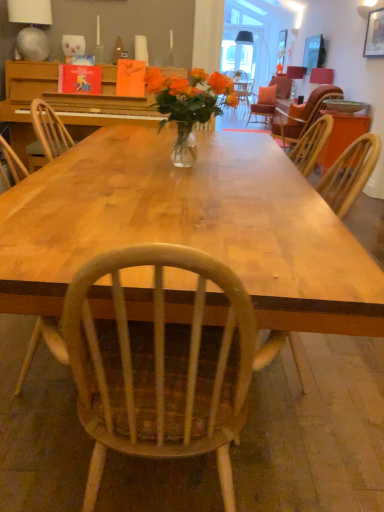
Identify the location of matte pink lampshade at upper right, which is the second lamp in top-to-bottom order. (320, 78).

What do you see at coordinates (296, 72) in the screenshot?
I see `matte black lampshade at upper center, placed as the 1th lamp when sorted from top to bottom` at bounding box center [296, 72].

Where is `matte white bowl at upper right`? Image resolution: width=384 pixels, height=512 pixels. matte white bowl at upper right is located at coordinates coord(345,106).

What is the approximate height of wooden chair at right?

wooden chair at right is 37.35 inches in height.

You are a GUI agent. You are given a task and a screenshot of the screen. Output one action in this format:
    pyautogui.click(x=<x>, y=<y>)
    Task: Click on the matte pink lampshade at upper right, which is the second lamp in top-to-bottom order
    
    Given the screenshot: What is the action you would take?
    pyautogui.click(x=320, y=78)

From a real-world perspective, which object rests below the other?

wooden table at right, from a real-world perspective.

Does matte white bowl at upper right have a smaller size compared to wooden table at right?

Yes, matte white bowl at upper right is smaller than wooden table at right.

Is matte white bowl at upper right far from wooden table at right?

No, there isn't a large distance between matte white bowl at upper right and wooden table at right.

Which is more to the left, matte white bowl at upper right or wooden table at right?

From the viewer's perspective, wooden table at right appears more on the left side.

From the image's perspective, would you say wooden chair at right is positioned over shiny wood table at center?

Yes, from the image's perspective, wooden chair at right is on top of shiny wood table at center.

Does wooden chair at right lie behind shiny wood table at center?

Yes, it is behind shiny wood table at center.

Can you confirm if wooden chair at right is positioned to the left of shiny wood table at center?

No.

Is shiny wood table at center completely or partially inside wooden chair at right?

Definitely not — shiny wood table at center is not inside wooden chair at right.

From the picture: Is natural wood table at center far away from metallic silver lampshade at upper left, which is the first lamp from bottom to top?

That's right, there is a large distance between natural wood table at center and metallic silver lampshade at upper left, which is the first lamp from bottom to top.

Consider the image. Measure the distance from natural wood table at center to metallic silver lampshade at upper left, which is the first lamp from bottom to top.

natural wood table at center is 1.04 meters from metallic silver lampshade at upper left, which is the first lamp from bottom to top.

Between natural wood table at center and metallic silver lampshade at upper left, which is the first lamp from bottom to top, which one has larger size?

natural wood table at center.

Is natural wood table at center spatially inside metallic silver lampshade at upper left, which is the first lamp from bottom to top, or outside of it?

natural wood table at center lies outside metallic silver lampshade at upper left, which is the first lamp from bottom to top.

Which object is positioned more to the right, orange paper card at center, which appears as the 2th book when viewed from the left, or matte pink lampshade at upper right, which is the second lamp in top-to-bottom order?

Positioned to the right is matte pink lampshade at upper right, which is the second lamp in top-to-bottom order.

This screenshot has width=384, height=512. What are the coordinates of `lamp that is the 2nd object located above the orange paper card at center, which appears as the 2th book when viewed from the left (from the image's perspective)` in the screenshot? It's located at (320, 78).

Is orange paper card at center, which appears as the 2th book when viewed from the left, outside of matte pink lampshade at upper right, which is the second lamp in bottom-to-top order?

Yes, orange paper card at center, which appears as the 2th book when viewed from the left, is located beyond the bounds of matte pink lampshade at upper right, which is the second lamp in bottom-to-top order.

From the image's perspective, which object appears higher, orange paper card at center, which ranks as the 1th book in right-to-left order, or matte pink lampshade at upper right, which is the second lamp in top-to-bottom order?

matte pink lampshade at upper right, which is the second lamp in top-to-bottom order.

Is translucent glass vase at center located outside matte wooden frame at upper right?

Absolutely, translucent glass vase at center is external to matte wooden frame at upper right.

Which of these two, translucent glass vase at center or matte wooden frame at upper right, is bigger?

Bigger between the two is translucent glass vase at center.

Which point is more distant from viewer, (215, 93) or (378, 12)?

The point (378, 12) is more distant.

From their relative heights in the image, would you say translucent glass vase at center is taller or shorter than matte wooden frame at upper right?

Clearly, translucent glass vase at center is shorter compared to matte wooden frame at upper right.

In terms of size, does translucent glass vase at center appear bigger or smaller than matte black lampshade at upper center, placed as the third lamp when sorted from bottom to top?

In the image, translucent glass vase at center appears to be larger than matte black lampshade at upper center, placed as the third lamp when sorted from bottom to top.

From a real-world perspective, is translucent glass vase at center positioned above or below matte black lampshade at upper center, placed as the 1th lamp when sorted from back to front?

In terms of real-world spatial position, translucent glass vase at center is above matte black lampshade at upper center, placed as the 1th lamp when sorted from back to front.

Can you tell me how much translucent glass vase at center and matte black lampshade at upper center, placed as the 1th lamp when sorted from top to bottom, differ in facing direction?

89.6 degrees.

Image resolution: width=384 pixels, height=512 pixels. I want to click on flower in front of the matte black lampshade at upper center, placed as the third lamp when sorted from bottom to top, so pyautogui.click(x=190, y=95).

In terms of size, does wooden table at right appear bigger or smaller than translucent glass vase at center?

Considering their sizes, wooden table at right takes up more space than translucent glass vase at center.

From the image's perspective, is wooden table at right on translucent glass vase at center?

Yes, from the image's perspective, wooden table at right is above translucent glass vase at center.

Is wooden table at right positioned far away from translucent glass vase at center?

No, wooden table at right is not far from translucent glass vase at center.

Could you tell me if wooden table at right is facing translucent glass vase at center?

No, wooden table at right is not oriented towards translucent glass vase at center.

Locate an element on the screen. table behind the matte white bowl at upper right is located at coordinates (341, 135).

I want to click on desk that is under the wooden chair at right (from a real-world perspective), so click(190, 227).

Looking at the image, which one is located closer to orange paper card at center, which ranks as the 1th book in right-to-left order, matte black lampshade at upper center, placed as the third lamp when sorted from bottom to top, or shiny wood table at center?

Among the two, matte black lampshade at upper center, placed as the third lamp when sorted from bottom to top, is located nearer to orange paper card at center, which ranks as the 1th book in right-to-left order.

Looking at the image, which one is located further to shiny wood table at center, hardcover book at upper left, which ranks as the second book in right-to-left order, or matte black lampshade at upper center, which is the 3th lamp from front to back?

The object further to shiny wood table at center is matte black lampshade at upper center, which is the 3th lamp from front to back.

Based on their spatial positions, is hardcover book at upper left, which ranks as the second book in right-to-left order, or wooden table at right further from orange paper card at center, which ranks as the 1th book in right-to-left order?

wooden table at right is further to orange paper card at center, which ranks as the 1th book in right-to-left order.

Which object lies nearer to the anchor point orange paper card at center, which ranks as the 1th book in right-to-left order, matte pink lampshade at upper right, which is counted as the 2th lamp, starting from the right, or matte black lampshade at upper center, placed as the 1th lamp when sorted from top to bottom?

Based on the image, matte black lampshade at upper center, placed as the 1th lamp when sorted from top to bottom, appears to be nearer to orange paper card at center, which ranks as the 1th book in right-to-left order.

When comparing their distances from hardcover book at upper left, which ranks as the second book in right-to-left order, does natural wood table at center or wooden chair at right seem closer?

Among the two, natural wood table at center is located nearer to hardcover book at upper left, which ranks as the second book in right-to-left order.

When comparing their distances from matte black lampshade at upper center, placed as the third lamp when sorted from bottom to top, does shiny wood table at center or matte wooden frame at upper right seem further?

shiny wood table at center is further to matte black lampshade at upper center, placed as the third lamp when sorted from bottom to top.

Considering their positions, is wooden chair at right positioned closer to matte pink lampshade at upper right, which is counted as the 2th lamp, starting from the right, than matte wooden frame at upper right?

The object closer to matte pink lampshade at upper right, which is counted as the 2th lamp, starting from the right, is matte wooden frame at upper right.

Looking at this image, estimate the real-world distances between objects in this image. Which object is closer to wooden chair at right, translucent glass vase at center or matte wooden frame at upper right?

Based on the image, translucent glass vase at center appears to be nearer to wooden chair at right.

I want to click on kitchen & dining room table positioned between shiny wood table at center and matte pink lampshade at upper right, marked as the second lamp in a front-to-back arrangement, from near to far, so click(x=103, y=120).

Locate an element on the screen. This screenshot has width=384, height=512. chair between shiny wood table at center and matte black lampshade at upper center, placed as the third lamp when sorted from bottom to top, in the front-back direction is located at coordinates (304, 114).

Find the location of a particular element. This screenshot has width=384, height=512. bowl between shiny wood table at center and wooden chair at right along the z-axis is located at coordinates (345, 106).

Locate an element on the screen. chair positioned between shiny wood table at center and matte pink lampshade at upper right, positioned as the second lamp in left-to-right order, from near to far is located at coordinates (304, 114).